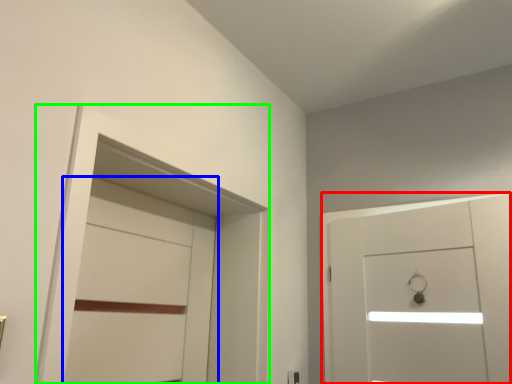
Question: Which object is positioned closest to door (highlighted by a red box)? Select from door (highlighted by a blue box) and locker (highlighted by a green box).

Choices:
 (A) door
 (B) locker

Answer: (B)